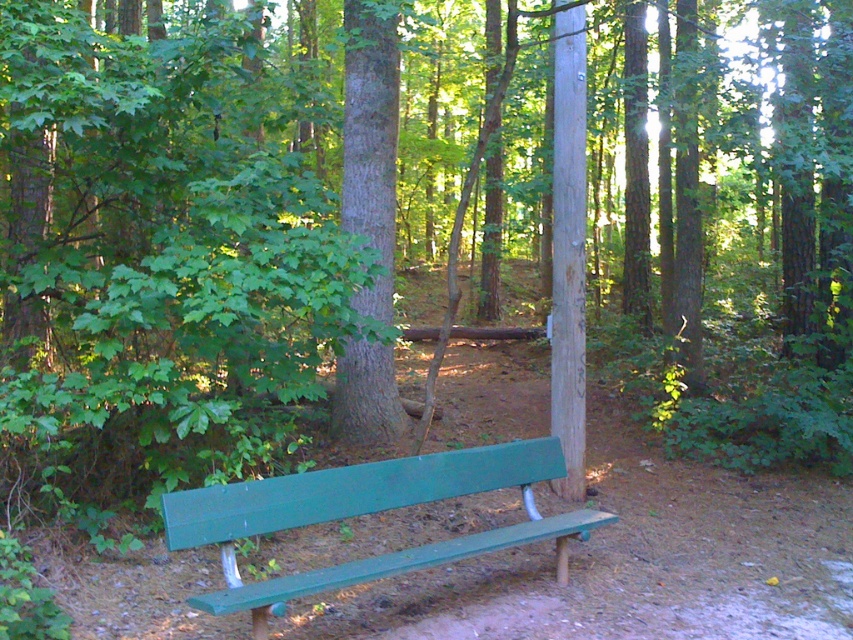
Which of these two, green painted wood bench at center or green rough bark tree at center, stands taller?

green rough bark tree at center

You are a GUI agent. You are given a task and a screenshot of the screen. Output one action in this format:
    pyautogui.click(x=<x>, y=<y>)
    Task: Click on the green painted wood bench at center
    
    Given the screenshot: What is the action you would take?
    pyautogui.click(x=366, y=513)